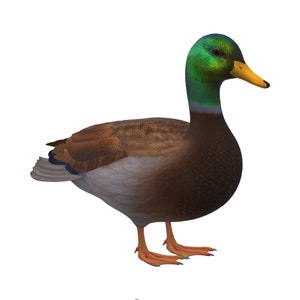
Find the location of a particular element. This screenshot has height=300, width=300. brown chest is located at coordinates (216, 180).